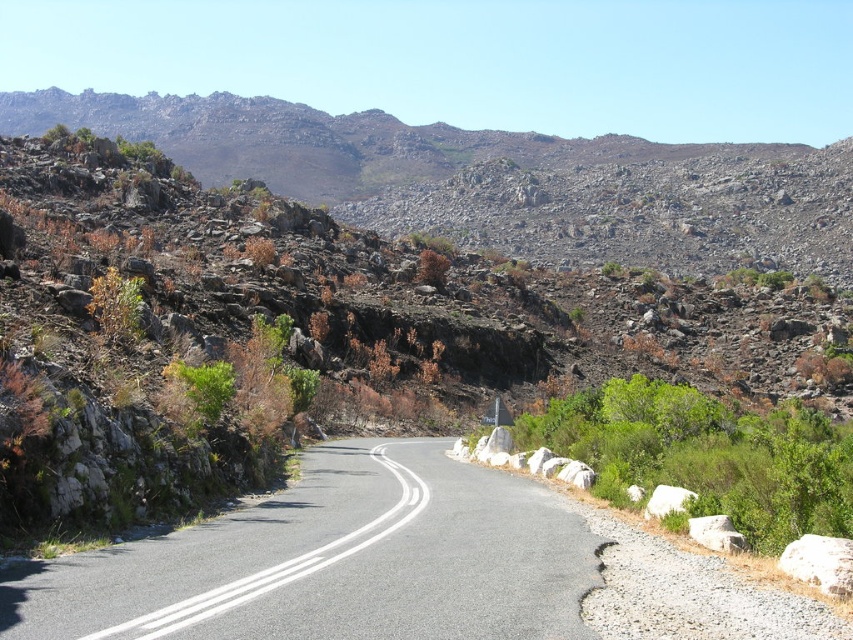
You are a hiker planning to cross the asphalt road at center and the gray rough rock at right. Which path would be safer for walking?

The asphalt road at center has a greater height compared to the gray rough rock at right, so it would be safer to walk on the asphalt road at center as it provides a more stable and elevated surface.

You are driving a car and want to park near the asphalt road at center. There is a white rock at lower right nearby. Can you park between them without crossing the road?

The asphalt road at center is closer to the viewer than the white rock at lower right, so you can park between them without crossing the road.

You are a hiker planning to cross the rugged terrain shown in the image. You see the asphalt road at center and the gray rough rock at right. Which path would you choose if you want to travel a longer distance without obstacles?

The asphalt road at center is larger in size than the gray rough rock at right, so choosing the asphalt road at center would allow you to travel a longer distance without obstacles since it is wider and more suitable for passage.